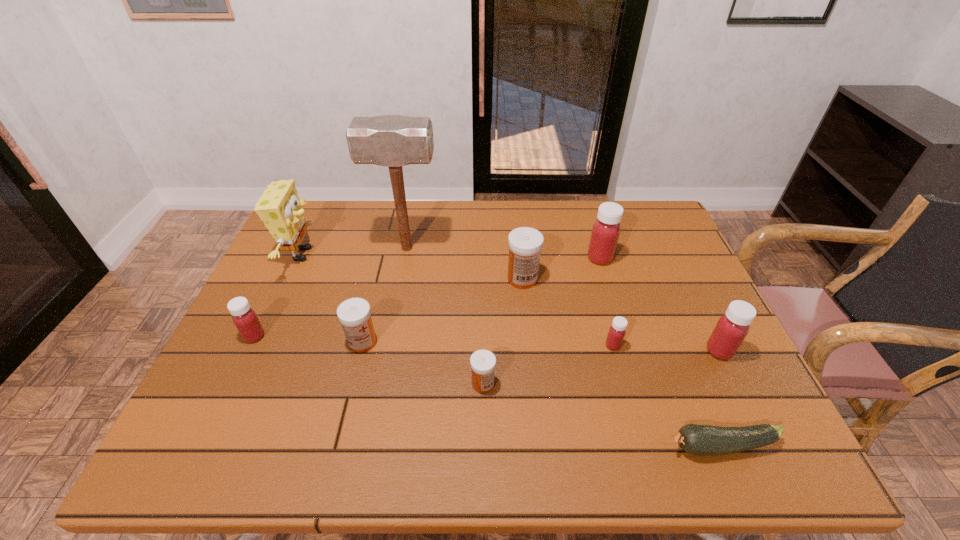
Identify the location of blank region between the third biggest red medicine and the second biggest white medicine. The image size is (960, 540). (308, 339).

This screenshot has width=960, height=540. I want to click on vacant area that lies between the shortest object and the third medicine from left to right, so click(602, 415).

What are the coordinates of `vacant point located between the ninth shortest object and the smallest red medicine` in the screenshot? It's located at (457, 300).

Find the location of `vacant space in between the nearest object and the eighth shortest object`. vacant space in between the nearest object and the eighth shortest object is located at coordinates (660, 352).

Locate an element on the screen. This screenshot has height=540, width=960. object that stands as the ninth closest to the yellow sponge is located at coordinates (731, 329).

Identify which object is located as the eighth nearest to the rightmost medicine. Please provide its 2D coordinates. Your answer should be formatted as a tuple, i.e. [(x, y)], where the tuple contains the x and y coordinates of a point satisfying the conditions above.

[(280, 208)]

Identify the location of medicine that stands as the third closest to the rightmost white medicine. point(483,362).

Choose which medicine is the nearest neighbor to the leftmost medicine. Please provide its 2D coordinates. Your answer should be formatted as a tuple, i.e. [(x, y)], where the tuple contains the x and y coordinates of a point satisfying the conditions above.

[(354, 314)]

Find the location of `red medicine that stands as the fourth closest to the sponge`. red medicine that stands as the fourth closest to the sponge is located at coordinates (731, 329).

What are the coordinates of `red medicine that stands as the second closest to the second biggest white medicine` in the screenshot? It's located at (616, 333).